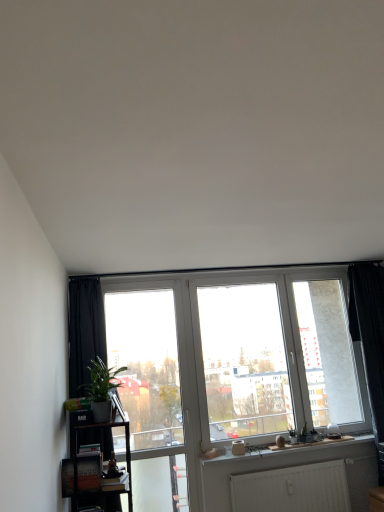
Measure the distance between point (109, 308) and camera.

Point (109, 308) is 5.17 meters from camera.

The height and width of the screenshot is (512, 384). What do you see at coordinates (369, 331) in the screenshot?
I see `black fabric curtain at right` at bounding box center [369, 331].

This screenshot has width=384, height=512. In order to click on transparent glass screen door at center in this screenshot , I will do `click(150, 388)`.

Between black wooden shelf at lower left and green leafy plant at left, which one has more height?

black wooden shelf at lower left.

From the image's perspective, between black wooden shelf at lower left and green leafy plant at left, who is located below?

From the image's view, black wooden shelf at lower left is below.

Do you think black wooden shelf at lower left is within green leafy plant at left, or outside of it?

black wooden shelf at lower left is outside green leafy plant at left.

Is green leafy plant at left looking in the opposite direction of black fabric curtain at right?

No, green leafy plant at left is not facing away from black fabric curtain at right.

Which of these two, green leafy plant at left or black fabric curtain at right, is smaller?

green leafy plant at left.

Does point (93, 405) appear closer or farther from the camera than point (373, 370)?

Clearly, point (93, 405) is closer to the camera than point (373, 370).

Considering the positions of objects green leafy plant at left and black fabric curtain at right in the image provided, who is more to the right, green leafy plant at left or black fabric curtain at right?

black fabric curtain at right.

Is green leafy plant at left at the right side of transparent glass screen door at center?

No, green leafy plant at left is not to the right of transparent glass screen door at center.

Which is correct: green leafy plant at left is inside transparent glass screen door at center, or outside of it?

green leafy plant at left cannot be found inside transparent glass screen door at center.

Locate an element on the screen. The width and height of the screenshot is (384, 512). screen door lying below the green leafy plant at left (from the image's perspective) is located at coordinates (150, 388).

Consider the image. How many degrees apart are the facing directions of green leafy plant at left and transparent glass screen door at center?

The angular difference between green leafy plant at left and transparent glass screen door at center is 88.6 degrees.

Does black wooden shelf at lower left have a greater height compared to transparent glass screen door at center?

Incorrect, the height of black wooden shelf at lower left is not larger of that of transparent glass screen door at center.

Considering the relative positions of black wooden shelf at lower left and transparent glass screen door at center in the image provided, is black wooden shelf at lower left to the left or to the right of transparent glass screen door at center?

In the image, black wooden shelf at lower left appears on the left side of transparent glass screen door at center.

From a real-world perspective, does black wooden shelf at lower left stand above transparent glass screen door at center?

No, from a real-world perspective, black wooden shelf at lower left is not above transparent glass screen door at center.

Which point is more forward, (142, 483) or (383, 367)?

The point (142, 483) is closer to the camera.

Can you confirm if transparent glass screen door at center is thinner than black fabric curtain at right?

Correct, the width of transparent glass screen door at center is less than that of black fabric curtain at right.

Are transparent glass screen door at center and black fabric curtain at right far apart?

Yes, transparent glass screen door at center is far from black fabric curtain at right.

You are a GUI agent. You are given a task and a screenshot of the screen. Output one action in this format:
    pyautogui.click(x=<x>, y=<y>)
    Task: Click on the screen door that appears above the black fabric curtain at right (from a real-world perspective)
    
    Given the screenshot: What is the action you would take?
    pyautogui.click(x=150, y=388)

Is green leafy plant at left located within black fabric curtain at right?

No, black fabric curtain at right does not contain green leafy plant at left.

Can you see black fabric curtain at right touching green leafy plant at left?

No, black fabric curtain at right is not next to green leafy plant at left.

Could you tell me if black fabric curtain at right is facing green leafy plant at left?

No, black fabric curtain at right is not aimed at green leafy plant at left.

Does point (111, 400) appear closer or farther from the camera than point (75, 460)?

Point (111, 400) appears to be farther away from the viewer than point (75, 460).

Consider the image. Is green leafy plant at left behind black wooden shelf at lower left?

Yes, it is.

Is green leafy plant at left aimed at black wooden shelf at lower left?

No, green leafy plant at left is not oriented towards black wooden shelf at lower left.

What are the coordinates of `shelf that appears below the green leafy plant at left (from a real-world perspective)` in the screenshot? It's located at (90, 463).

You are a GUI agent. You are given a task and a screenshot of the screen. Output one action in this format:
    pyautogui.click(x=<x>, y=<y>)
    Task: Click on the curtain lying on the right of green leafy plant at left
    This screenshot has width=384, height=512.
    Given the screenshot: What is the action you would take?
    pyautogui.click(x=369, y=331)

From the picture: From the image, which object appears to be nearer to green leafy plant at left, black wooden shelf at lower left or black fabric curtain at right?

black wooden shelf at lower left.

Considering their positions, is transparent glass screen door at center positioned further to green leafy plant at left than black wooden shelf at lower left?

transparent glass screen door at center lies further to green leafy plant at left than the other object.

Estimate the real-world distances between objects in this image. Which object is further from black wooden shelf at lower left, transparent glass screen door at center or black fabric curtain at right?

The object further to black wooden shelf at lower left is black fabric curtain at right.

When comparing their distances from black wooden shelf at lower left, does green leafy plant at left or transparent glass screen door at center seem further?

Among the two, transparent glass screen door at center is located further to black wooden shelf at lower left.

When comparing their distances from transparent glass screen door at center, does green leafy plant at left or black wooden shelf at lower left seem closer?

Among the two, black wooden shelf at lower left is located nearer to transparent glass screen door at center.

Estimate the real-world distances between objects in this image. Which object is closer to transparent glass screen door at center, black wooden shelf at lower left or black fabric curtain at right?

Based on the image, black wooden shelf at lower left appears to be nearer to transparent glass screen door at center.

Based on their spatial positions, is green leafy plant at left or black wooden shelf at lower left closer to black fabric curtain at right?

The object closer to black fabric curtain at right is green leafy plant at left.

Which object lies nearer to the anchor point transparent glass screen door at center, green leafy plant at left or black fabric curtain at right?

Based on the image, green leafy plant at left appears to be nearer to transparent glass screen door at center.

Where is `screen door between green leafy plant at left and black fabric curtain at right`? The height and width of the screenshot is (512, 384). screen door between green leafy plant at left and black fabric curtain at right is located at coordinates (150, 388).

The width and height of the screenshot is (384, 512). In order to click on houseplant between black wooden shelf at lower left and black fabric curtain at right in this screenshot , I will do `click(103, 390)`.

I want to click on houseplant positioned between black wooden shelf at lower left and transparent glass screen door at center from near to far, so click(x=103, y=390).

Where is `screen door located between black wooden shelf at lower left and black fabric curtain at right in the left-right direction`? The height and width of the screenshot is (512, 384). screen door located between black wooden shelf at lower left and black fabric curtain at right in the left-right direction is located at coordinates (150, 388).